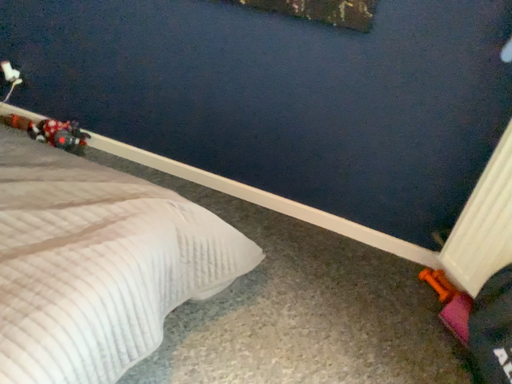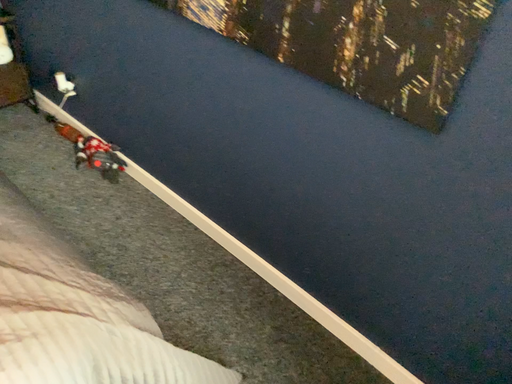
Question: How did the camera likely rotate when shooting the video?

Choices:
 (A) rotated right
 (B) rotated left

Answer: (B)